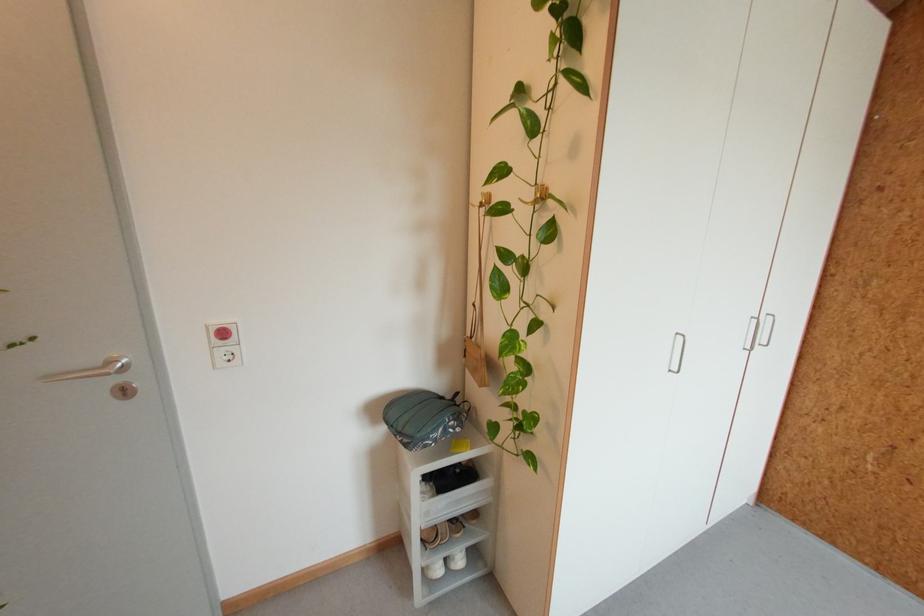
Find where to insert the door keyhole. Please return your answer as a coordinate pair (x, y).

(123, 391)